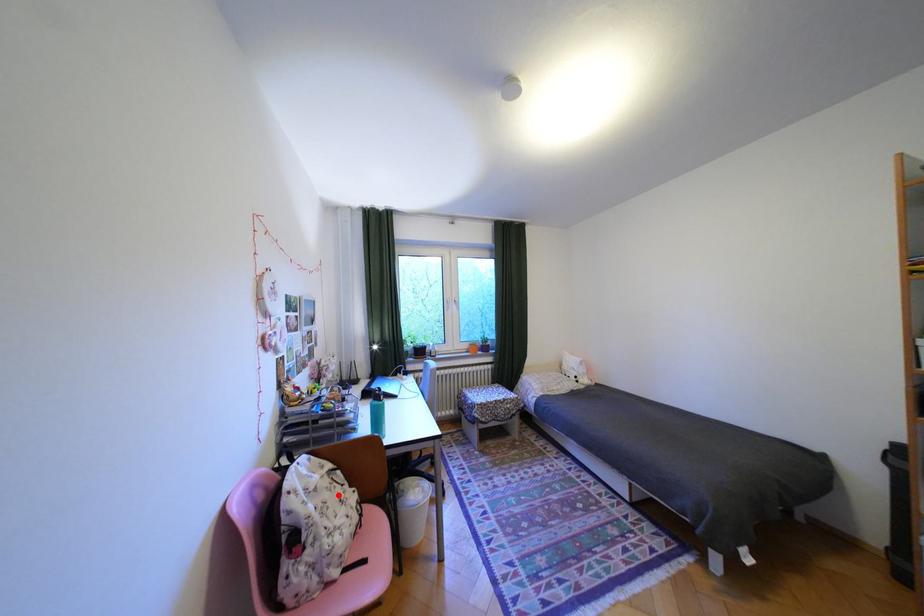
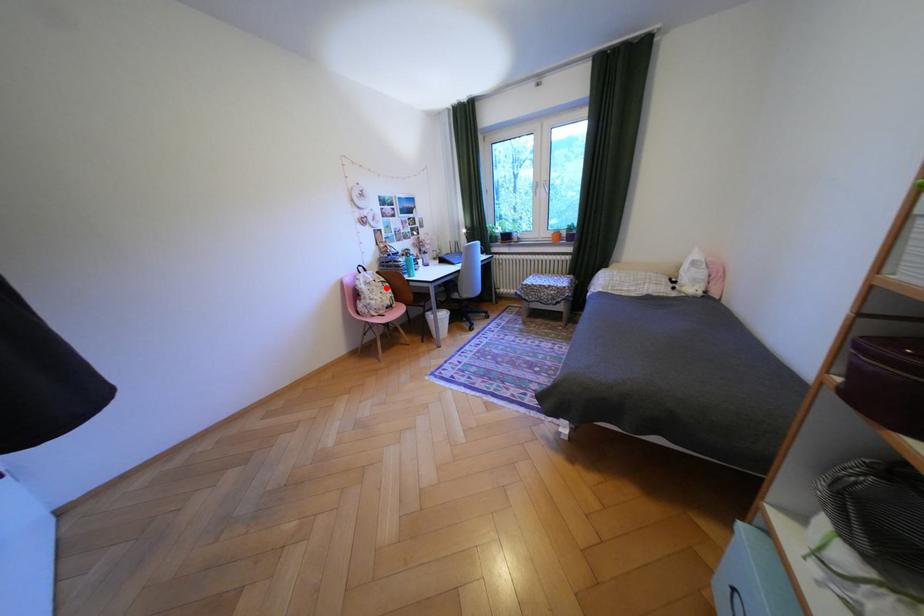
I am providing you with two images of the same scene from different viewpoints. A red point is marked on the first image and another point is marked on the second image. Is the red point in image1 aligned with the point shown in image2?

Yes